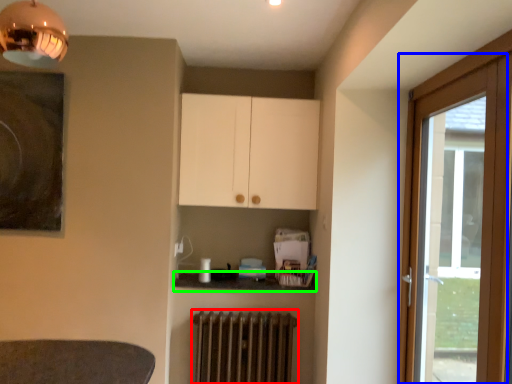
Question: Which object is positioned closest to radiator (highlighted by a red box)? Select from door (highlighted by a blue box) and counter top (highlighted by a green box).

Choices:
 (A) door
 (B) counter top

Answer: (B)